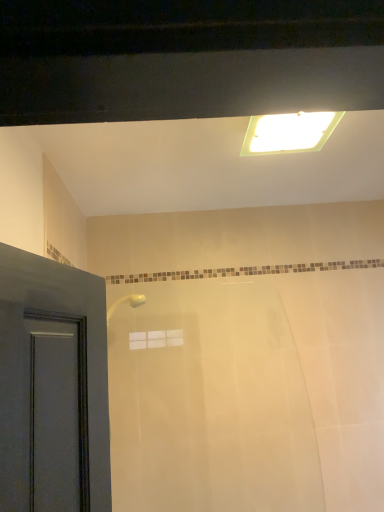
Question: Considering the positions of white fluorescent light at upper center and translucent plastic bathtub at center in the image, is white fluorescent light at upper center wider or thinner than translucent plastic bathtub at center?

Choices:
 (A) wide
 (B) thin

Answer: (A)

Question: From the image's perspective, relative to translucent plastic bathtub at center, is white fluorescent light at upper center above or below?

Choices:
 (A) below
 (B) above

Answer: (B)

Question: Considering the positions of white fluorescent light at upper center and translucent plastic bathtub at center in the image, is white fluorescent light at upper center bigger or smaller than translucent plastic bathtub at center?

Choices:
 (A) big
 (B) small

Answer: (B)

Question: From a real-world perspective, is translucent plastic bathtub at center positioned above or below white fluorescent light at upper center?

Choices:
 (A) above
 (B) below

Answer: (B)

Question: Does point (274, 352) appear closer or farther from the camera than point (302, 142)?

Choices:
 (A) closer
 (B) farther

Answer: (B)

Question: Would you say translucent plastic bathtub at center is inside or outside white fluorescent light at upper center?

Choices:
 (A) inside
 (B) outside

Answer: (B)

Question: Is translucent plastic bathtub at center in front of or behind white fluorescent light at upper center in the image?

Choices:
 (A) behind
 (B) front

Answer: (A)